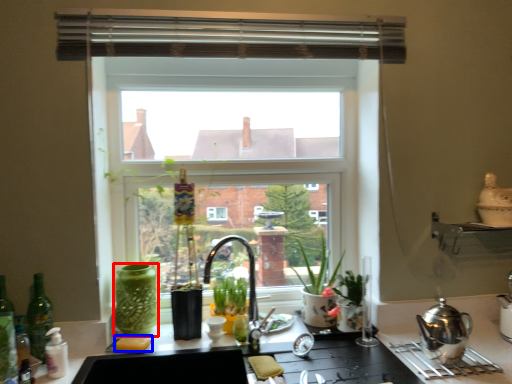
Question: Which point is further to the camera, glass vase (highlighted by a red box) or food (highlighted by a blue box)?

Choices:
 (A) glass vase
 (B) food

Answer: (A)